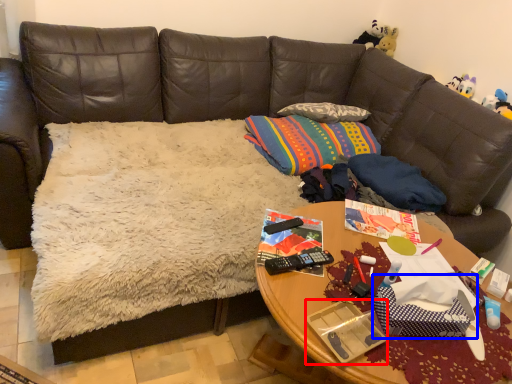
Question: Which object appears farthest to the camera in this image, package (highlighted by a red box) or gift bag (highlighted by a blue box)?

Choices:
 (A) package
 (B) gift bag

Answer: (B)